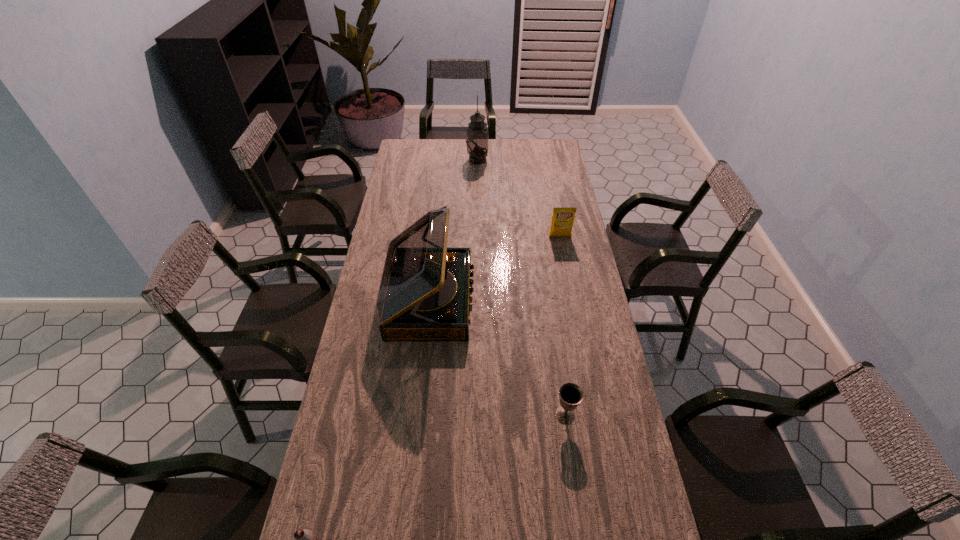
Find the location of a particular element. vacant space that's between the chalice and the oil lamp is located at coordinates (521, 288).

The image size is (960, 540). Identify the location of empty space between the chalice and the third tallest object. (563, 326).

Locate an element on the screen. This screenshot has height=540, width=960. vacant region between the fourth nearest object and the third farthest object is located at coordinates (495, 268).

Locate an element on the screen. The height and width of the screenshot is (540, 960). empty space that is in between the farthest object and the third tallest object is located at coordinates [518, 198].

This screenshot has width=960, height=540. I want to click on free point between the fourth object from left to right and the rightmost object, so click(x=563, y=326).

You are a GUI agent. You are given a task and a screenshot of the screen. Output one action in this format:
    pyautogui.click(x=<x>, y=<y>)
    Task: Click on the free space that is in between the fourth object from left to right and the third tallest object
    
    Given the screenshot: What is the action you would take?
    pyautogui.click(x=563, y=326)

Select which object is the third closest to the record player. Please provide its 2D coordinates. Your answer should be formatted as a tuple, i.e. [(x, y)], where the tuple contains the x and y coordinates of a point satisfying the conditions above.

[(304, 539)]

Locate which object ranks in proximity to the chocolate milk. Please provide its 2D coordinates. Your answer should be formatted as a tuple, i.e. [(x, y)], where the tuple contains the x and y coordinates of a point satisfying the conditions above.

[(424, 292)]

The height and width of the screenshot is (540, 960). I want to click on vacant area that satisfies the following two spatial constraints: 1. on the front-facing side of the second object from right to left; 2. on the right side of the record player, so click(x=418, y=416).

At what (x,y) coordinates should I click in order to perform the action: click on vacant space that satisfies the following two spatial constraints: 1. on the front of the fourth nearest object with the logo; 2. on the front-facing side of the record player. Please return your answer as a coordinate pair (x, y). Image resolution: width=960 pixels, height=540 pixels. Looking at the image, I should click on (572, 300).